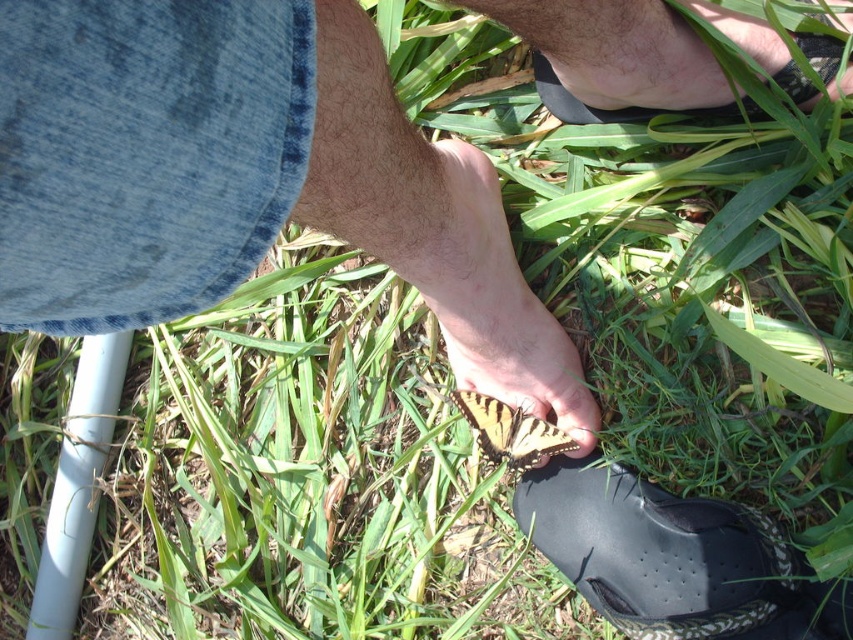
You are a drone operator trying to capture a photo of the butterfly on the person. The camera is positioned at the origin point. The black rubber shoe at lower right is at point 0.873, 0.789. What is the coordinate of the butterfly?

The butterfly is perched on one of the person s toes, which is part of the black rubber shoe at lower right located at coordinate (672, 557). Therefore, the butterfly is at coordinate (672, 557).